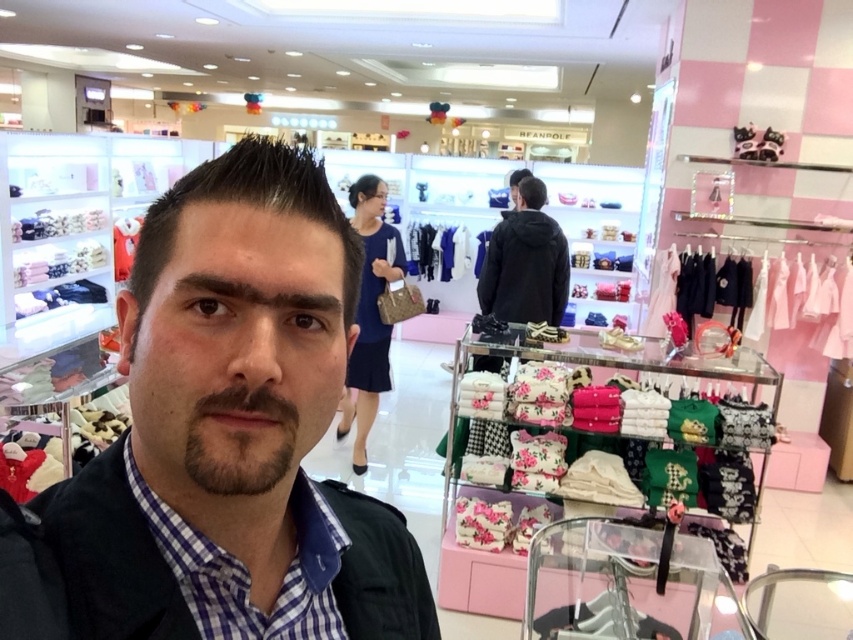
You are a customer in the store and want to know which item is taller between the matte black jacket at center and the blue checkered shirt at center. Can you tell me?

The matte black jacket at center is taller than the blue checkered shirt at center.

You are a customer in the store looking for a jacket. You see both the matte black jacket at center and the black fleece jacket at center. Which one is positioned to the left?

The matte black jacket at center is positioned to the left of the black fleece jacket at center.

You are a customer in the store and want to buy a shirt and a jacket. The store has a blue checkered shirt at center and a black fleece jacket at center. Which item takes up more space on the shelf?

The black fleece jacket at center takes up more space on the shelf than the blue checkered shirt at center because the blue checkered shirt at center occupies less space than black fleece jacket at center.